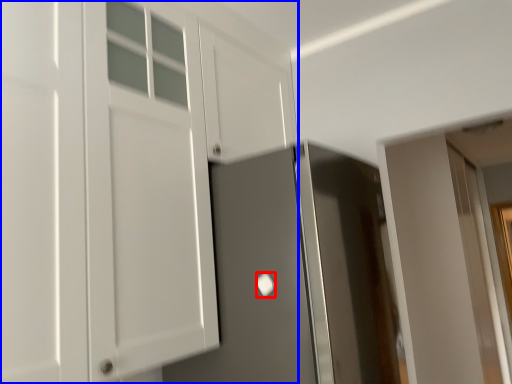
Question: Which object appears farthest to the camera in this image, door handle (highlighted by a red box) or cabinetry (highlighted by a blue box)?

Choices:
 (A) door handle
 (B) cabinetry

Answer: (A)